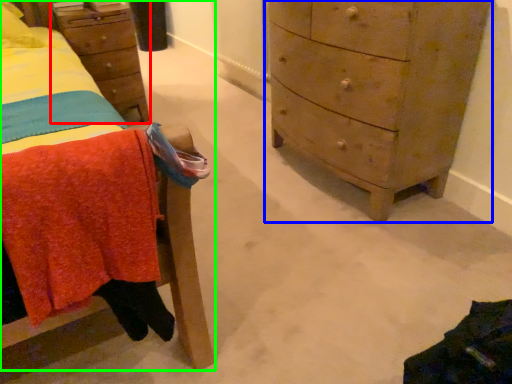
Question: Based on their relative distances, which object is nearer to nightstand (highlighted by a red box)? Choose from chest of drawers (highlighted by a blue box) and furniture (highlighted by a green box).

Choices:
 (A) chest of drawers
 (B) furniture

Answer: (B)